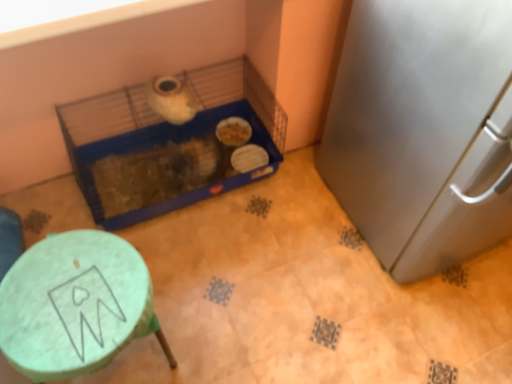
The height and width of the screenshot is (384, 512). Find the location of `vacant space situated above green matte stool at lower left (from a real-world perspective)`. vacant space situated above green matte stool at lower left (from a real-world perspective) is located at coordinates (68, 293).